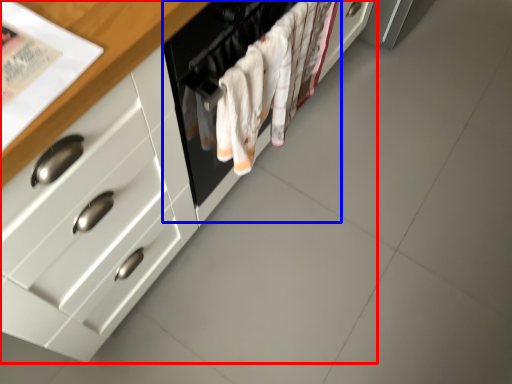
Question: Which of the following is the farthest to the observer, cabinetry (highlighted by a red box) or oven (highlighted by a blue box)?

Choices:
 (A) cabinetry
 (B) oven

Answer: (B)